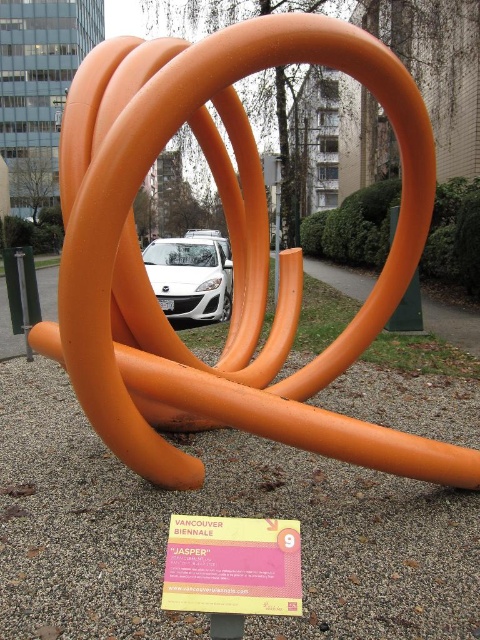
Question: Estimate the real-world distances between objects in this image. Which object is closer to the orange matte sculpture at center?

Choices:
 (A) white glossy car at center
 (B) pink paper at center

Answer: (B)

Question: Does pink paper at center lie in front of white glossy car at center?

Choices:
 (A) yes
 (B) no

Answer: (A)

Question: Is orange matte sculpture at center smaller than white glossy car at center?

Choices:
 (A) yes
 (B) no

Answer: (A)

Question: Which point appears farthest from the camera in this image?

Choices:
 (A) (187, 269)
 (B) (200, 572)

Answer: (A)

Question: Which object is the farthest from the white glossy car at center?

Choices:
 (A) orange matte sculpture at center
 (B) pink paper at center

Answer: (B)

Question: Is orange matte sculpture at center to the right of white glossy car at center from the viewer's perspective?

Choices:
 (A) no
 (B) yes

Answer: (B)